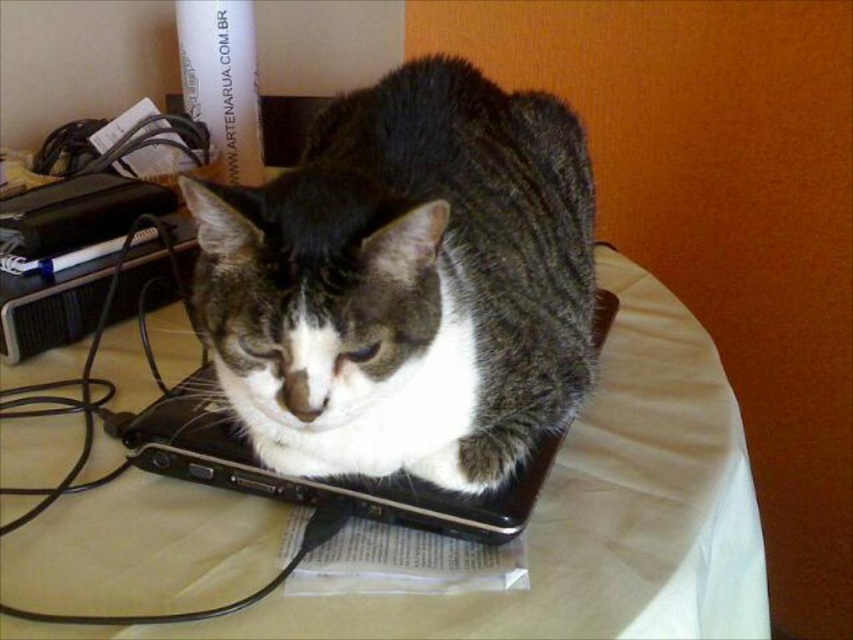
You need to place a rectangular box that is 1.2 times the width of the black plastic laptop at center on the table. Can the beige fabric tablecloth at center accommodate this box without overlapping the laptop?

The beige fabric tablecloth at center is wider than the black plastic laptop at center. Since the box is only 1.2 times the laptop width, the tablecloth can accommodate it without overlapping the laptop.

You are trying to place a small plant on the table without disturbing the gray tabby cat at center. Based on the coordinates provided, where should you place it?

The gray tabby cat at center is located at coordinates point (405, 282). To avoid disturbing it, place the plant away from this position, perhaps near the edges or corners of the table.